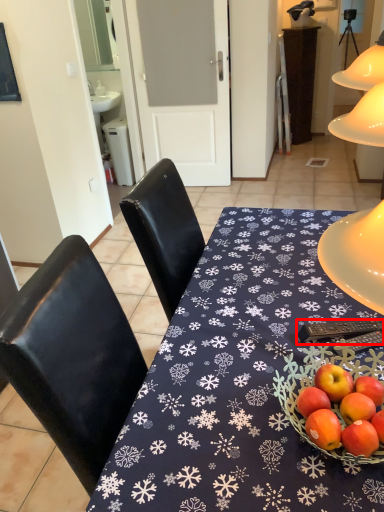
Question: Where is remote control (annotated by the red box) located in relation to desk in the image?

Choices:
 (A) left
 (B) right

Answer: (B)